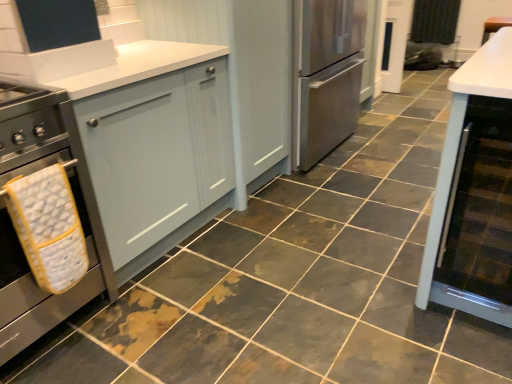
Where is `free region under matte glass cabinet at right, positioned as the 1th cabinetry in right-to-left order (from a real-world perspective)`? The width and height of the screenshot is (512, 384). free region under matte glass cabinet at right, positioned as the 1th cabinetry in right-to-left order (from a real-world perspective) is located at coordinates click(x=471, y=322).